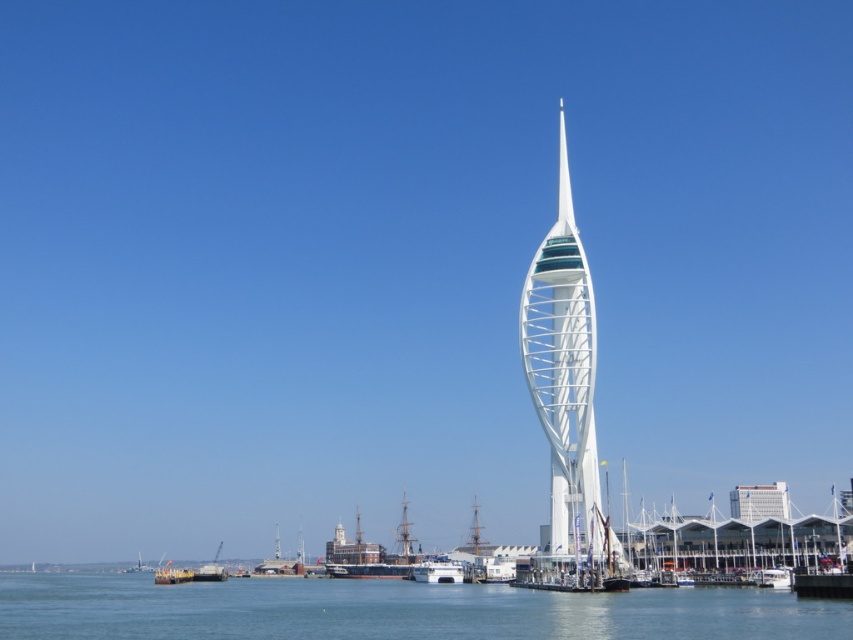
You are a photographer planning to capture the white glossy boat at center and the black wood dock at lower right in the same frame. Based on their sizes, which object should you position closer to the camera to ensure both are visible without cropping?

The black wood dock at lower right is larger in size than the white glossy boat at center. To include both in the frame without cropping, position the larger black wood dock at lower right closer to the camera so its size balances with the smaller white glossy boat at center.

You are standing on the dock and want to take a photo of the white glossy spire at center and the white wooden boat at lower left. Which object will appear larger in your camera viewfinder?

The white glossy spire at center will appear larger in the camera viewfinder because it is closer to the viewer than the white wooden boat at lower left.